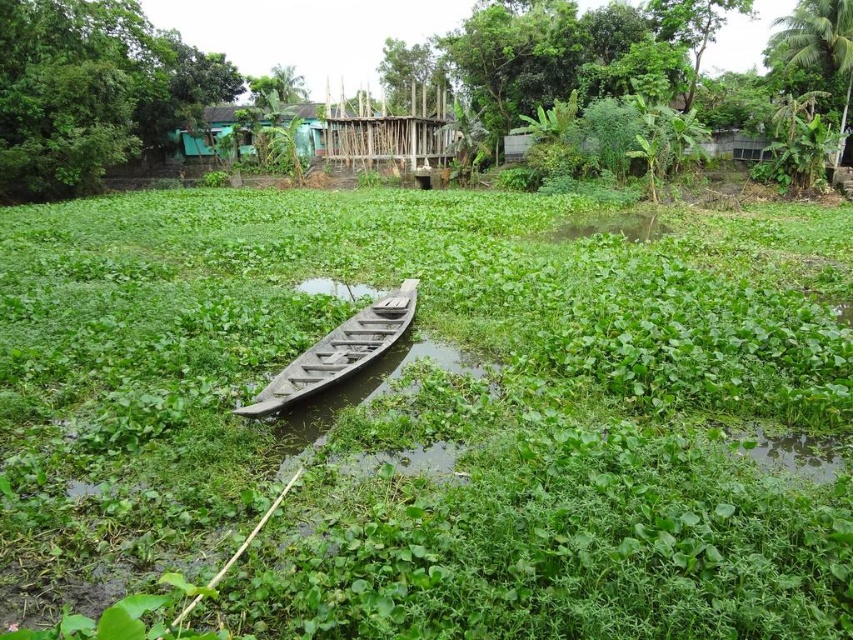
Question: Which object is closer to the camera taking this photo?

Choices:
 (A) green matte grass at center
 (B) green leafy plants at center
 (C) wooden canoe at center

Answer: (A)

Question: Estimate the real-world distances between objects in this image. Which object is closer to the wooden canoe at center?

Choices:
 (A) green matte grass at center
 (B) green leafy plants at center

Answer: (A)

Question: Where is green leafy plants at center located in relation to wooden canoe at center in the image?

Choices:
 (A) left
 (B) right

Answer: (A)

Question: In this image, where is green leafy plants at center located relative to wooden canoe at center?

Choices:
 (A) above
 (B) below

Answer: (A)

Question: Which point is closer to the camera taking this photo?

Choices:
 (A) (747, 253)
 (B) (512, 61)

Answer: (A)

Question: Does green matte grass at center appear on the left side of green leafy plants at center?

Choices:
 (A) no
 (B) yes

Answer: (A)